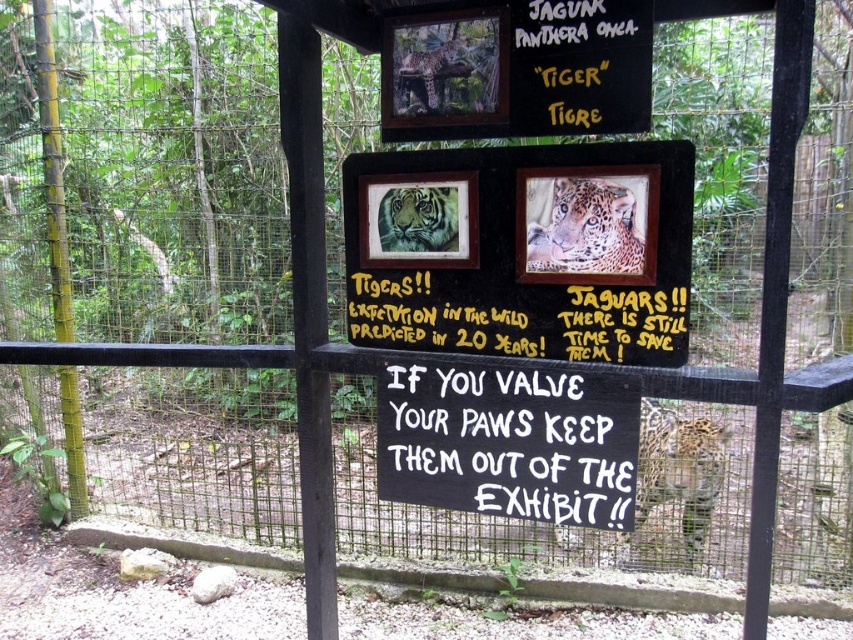
Which of these two, black chalkboard at center or spotted fur jaguar at center, stands shorter?

Standing shorter between the two is black chalkboard at center.

Between black chalkboard at center and spotted fur jaguar at center, which one appears on the right side from the viewer's perspective?

From the viewer's perspective, spotted fur jaguar at center appears more on the right side.

Is point (424, 432) less distant than point (653, 465)?

Yes, it is in front of point (653, 465).

Locate an element on the screen. This screenshot has height=640, width=853. black chalkboard at center is located at coordinates (508, 442).

Measure the distance between wooden signboard at center and camera.

A distance of 1.94 meters exists between wooden signboard at center and camera.

Does wooden signboard at center appear over sandy fur tiger at center?

No, wooden signboard at center is not above sandy fur tiger at center.

Locate an element on the screen. The image size is (853, 640). wooden signboard at center is located at coordinates (521, 250).

Can you confirm if spotted fur leopard at center is positioned below sandy fur tiger at center?

Indeed, spotted fur leopard at center is positioned under sandy fur tiger at center.

Measure the distance between spotted fur leopard at center and camera.

spotted fur leopard at center is 6.56 feet away from camera.

You are a GUI agent. You are given a task and a screenshot of the screen. Output one action in this format:
    pyautogui.click(x=<x>, y=<y>)
    Task: Click on the spotted fur leopard at center
    The width and height of the screenshot is (853, 640).
    Given the screenshot: What is the action you would take?
    pyautogui.click(x=585, y=230)